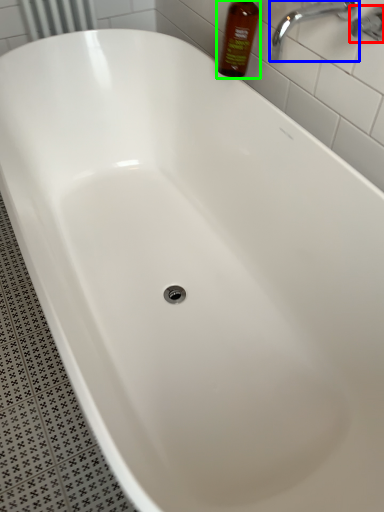
Question: Estimate the real-world distances between objects in this image. Which object is farther from plumbing fixture (highlighted by a red box), tap (highlighted by a blue box) or bottle (highlighted by a green box)?

Choices:
 (A) tap
 (B) bottle

Answer: (B)